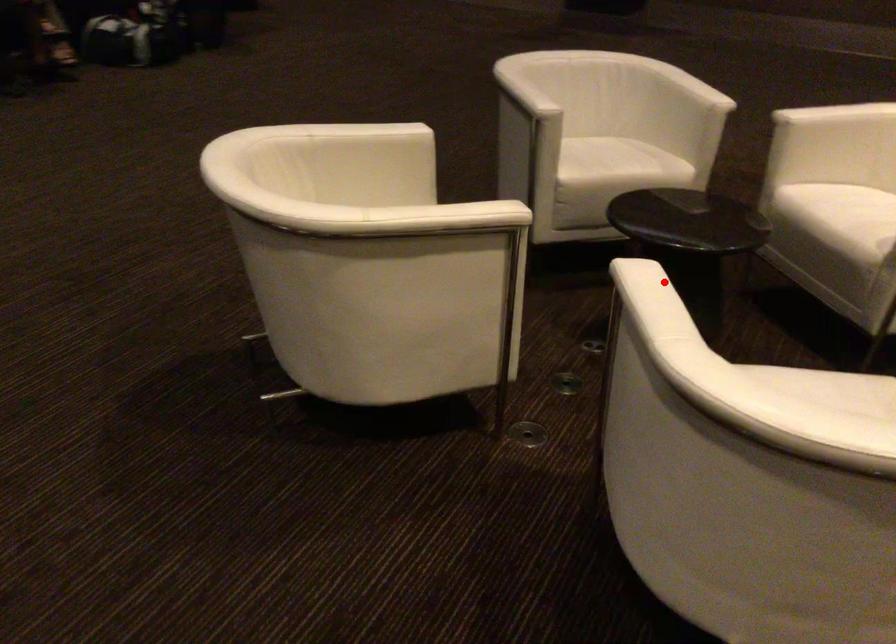
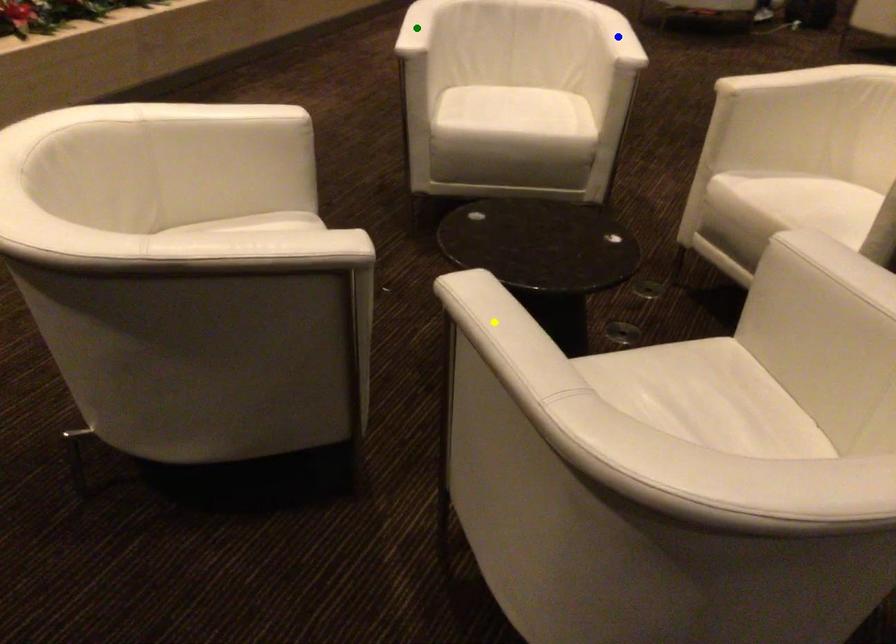
Question: I am providing you with two images of the same scene from different viewpoints. A red point is marked on the first image. You are given multiple points on the second image. Which point in image 2 is actually the same real-world point as the red point in image 1?

Choices:
 (A) blue point
 (B) green point
 (C) yellow point

Answer: (A)